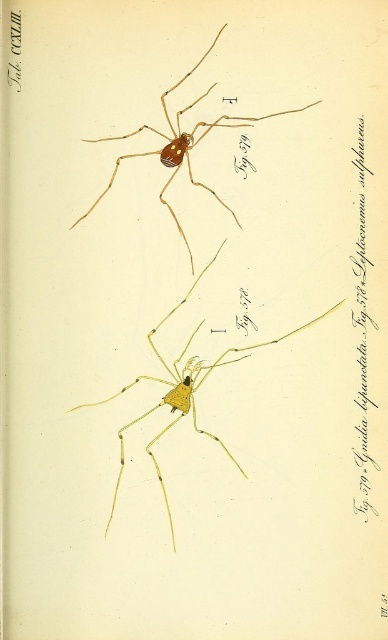
Question: Which point is farther from the camera taking this photo?

Choices:
 (A) (154, 456)
 (B) (98, 196)

Answer: (B)

Question: Which point is farther to the camera?

Choices:
 (A) (207, 433)
 (B) (228, 116)

Answer: (A)

Question: Does yellow matte spider at center lie behind yellow matte spider at upper center?

Choices:
 (A) yes
 (B) no

Answer: (A)

Question: Is yellow matte spider at center smaller than yellow matte spider at upper center?

Choices:
 (A) yes
 (B) no

Answer: (B)

Question: Does yellow matte spider at center have a greater width compared to yellow matte spider at upper center?

Choices:
 (A) yes
 (B) no

Answer: (A)